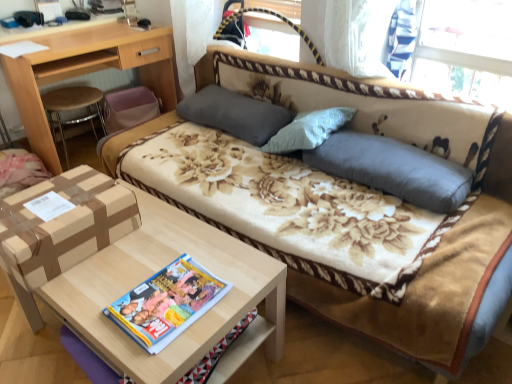
This screenshot has height=384, width=512. What do you see at coordinates (64, 224) in the screenshot? I see `brown cardboard box at lower left` at bounding box center [64, 224].

Locate an element on the screen. gray fabric pillow at center, acting as the 1th pillow starting from the front is located at coordinates (393, 169).

What is the approximate width of light brown wood desk at upper left?

It is 20.64 inches.

Where is `floral fabric studio couch at center`? floral fabric studio couch at center is located at coordinates (428, 280).

The height and width of the screenshot is (384, 512). I want to click on gray fabric pillow at center, which appears as the second pillow when viewed from the front, so coord(234,114).

Would you say gray fabric pillow at center, marked as the first pillow in a right-to-left arrangement, is inside or outside brown cardboard box at lower left?

gray fabric pillow at center, marked as the first pillow in a right-to-left arrangement, is located beyond the bounds of brown cardboard box at lower left.

From a real-world perspective, is gray fabric pillow at center, marked as the first pillow in a right-to-left arrangement, below brown cardboard box at lower left?

Yes, from a real-world perspective, gray fabric pillow at center, marked as the first pillow in a right-to-left arrangement, is below brown cardboard box at lower left.

Is point (435, 181) positioned before point (88, 199)?

That is False.

Locate an element on the screen. cardboard box above the gray fabric pillow at center, the second pillow in the left-to-right sequence (from a real-world perspective) is located at coordinates (64, 224).

Can you confirm if brown cardboard box at lower left is smaller than floral fabric studio couch at center?

Yes.

Is there a large distance between brown cardboard box at lower left and floral fabric studio couch at center?

brown cardboard box at lower left is near floral fabric studio couch at center, not far away.

From a real-world perspective, which is physically below, brown cardboard box at lower left or floral fabric studio couch at center?

From a 3D spatial view, floral fabric studio couch at center is below.

Could you tell me if brown cardboard box at lower left is turned towards floral fabric studio couch at center?

No, brown cardboard box at lower left is not oriented towards floral fabric studio couch at center.

Is light brown wood table at lower left shorter than floral fabric studio couch at center?

Yes.

At what (x,y) coordinates should I click in order to perform the action: click on studio couch in front of the light brown wood table at lower left. Please return your answer as a coordinate pair (x, y). This screenshot has width=512, height=384. Looking at the image, I should click on (428, 280).

Is light brown wood table at lower left to the left or to the right of floral fabric studio couch at center in the image?

light brown wood table at lower left is to the left of floral fabric studio couch at center.

From the image's perspective, who appears lower, light brown wood table at lower left or floral fabric studio couch at center?

light brown wood table at lower left is shown below in the image.

From a real-world perspective, between gray fabric pillow at center, which appears as the first pillow when viewed from the back, and gray fabric pillow at center, marked as the first pillow in a right-to-left arrangement, who is vertically higher?

From a 3D spatial view, gray fabric pillow at center, which appears as the first pillow when viewed from the back, is above.

Is gray fabric pillow at center, the first pillow viewed from the left, positioned before gray fabric pillow at center, the second pillow positioned from the back?

No.

Is gray fabric pillow at center, acting as the 1th pillow starting from the front, surrounded by gray fabric pillow at center, the first pillow viewed from the left?

That's incorrect, gray fabric pillow at center, acting as the 1th pillow starting from the front, is not inside gray fabric pillow at center, the first pillow viewed from the left.

From the image's perspective, is gray fabric pillow at center, marked as the 2th pillow in a right-to-left arrangement, on gray fabric pillow at center, acting as the 1th pillow starting from the front?

Yes, from the image's perspective, gray fabric pillow at center, marked as the 2th pillow in a right-to-left arrangement, is on top of gray fabric pillow at center, acting as the 1th pillow starting from the front.

Can you tell me how much light brown wood table at lower left and multicolored glossy magazine at center differ in facing direction?

There is a 0.209-degree angle between the facing directions of light brown wood table at lower left and multicolored glossy magazine at center.

Is light brown wood table at lower left at the right side of multicolored glossy magazine at center?

No.

Does light brown wood table at lower left have a lesser width compared to multicolored glossy magazine at center?

Incorrect, the width of light brown wood table at lower left is not less than that of multicolored glossy magazine at center.

Identify the location of desk behind the multicolored glossy magazine at center. The image size is (512, 384). (87, 71).

Considering the sizes of objects multicolored glossy magazine at center and light brown wood desk at upper left in the image provided, who is thinner, multicolored glossy magazine at center or light brown wood desk at upper left?

multicolored glossy magazine at center.

Which object is positioned more to the left, multicolored glossy magazine at center or light brown wood desk at upper left?

light brown wood desk at upper left is more to the left.

How different are the orientations of light brown wood desk at upper left and light brown wood table at lower left in degrees?

The angular difference between light brown wood desk at upper left and light brown wood table at lower left is 85.1 degrees.

From a real-world perspective, is light brown wood desk at upper left physically below light brown wood table at lower left?

Incorrect, from a real-world perspective, light brown wood desk at upper left is higher than light brown wood table at lower left.

Where is `table in front of the light brown wood desk at upper left`? table in front of the light brown wood desk at upper left is located at coordinates (155, 272).

Choose the correct answer: Is light brown wood desk at upper left inside light brown wood table at lower left or outside it?

light brown wood desk at upper left lies outside light brown wood table at lower left.

Image resolution: width=512 pixels, height=384 pixels. Find the location of `cardboard box on the left of gray fabric pillow at center, the second pillow in the left-to-right sequence`. cardboard box on the left of gray fabric pillow at center, the second pillow in the left-to-right sequence is located at coordinates (64, 224).

At what (x,y) coordinates should I click in order to perform the action: click on studio couch above the brown cardboard box at lower left (from the image's perspective). Please return your answer as a coordinate pair (x, y). Image resolution: width=512 pixels, height=384 pixels. Looking at the image, I should click on (428, 280).

When comparing their distances from light brown wood table at lower left, does floral fabric studio couch at center or brown cardboard box at lower left seem closer?

Among the two, brown cardboard box at lower left is located nearer to light brown wood table at lower left.

From the image, which object appears to be nearer to gray fabric pillow at center, which appears as the second pillow when viewed from the front, gray fabric pillow at center, marked as the first pillow in a right-to-left arrangement, or multicolored glossy magazine at center?

gray fabric pillow at center, marked as the first pillow in a right-to-left arrangement, is closer to gray fabric pillow at center, which appears as the second pillow when viewed from the front.

Looking at the image, which one is located closer to light brown wood desk at upper left, light brown wood table at lower left or gray fabric pillow at center, marked as the 2th pillow in a right-to-left arrangement?

Based on the image, gray fabric pillow at center, marked as the 2th pillow in a right-to-left arrangement, appears to be nearer to light brown wood desk at upper left.

Based on their spatial positions, is multicolored glossy magazine at center or gray fabric pillow at center, the first pillow viewed from the left, further from gray fabric pillow at center, the second pillow in the left-to-right sequence?

Based on the image, multicolored glossy magazine at center appears to be further to gray fabric pillow at center, the second pillow in the left-to-right sequence.

From the image, which object appears to be farther from floral fabric studio couch at center, light brown wood table at lower left or multicolored glossy magazine at center?

multicolored glossy magazine at center is further to floral fabric studio couch at center.

From the image, which object appears to be farther from floral fabric studio couch at center, gray fabric pillow at center, the first pillow viewed from the left, or multicolored glossy magazine at center?

gray fabric pillow at center, the first pillow viewed from the left, is further to floral fabric studio couch at center.

Looking at the image, which one is located further to multicolored glossy magazine at center, brown cardboard box at lower left or light brown wood desk at upper left?

light brown wood desk at upper left is further to multicolored glossy magazine at center.

When comparing their distances from brown cardboard box at lower left, does light brown wood table at lower left or gray fabric pillow at center, marked as the first pillow in a right-to-left arrangement, seem further?

gray fabric pillow at center, marked as the first pillow in a right-to-left arrangement.

The width and height of the screenshot is (512, 384). What are the coordinates of `table between floral fabric studio couch at center and gray fabric pillow at center, marked as the 2th pillow in a right-to-left arrangement, in the front-back direction` in the screenshot? It's located at (155, 272).

Locate an element on the screen. Image resolution: width=512 pixels, height=384 pixels. pillow between light brown wood desk at upper left and gray fabric pillow at center, the second pillow in the left-to-right sequence, from left to right is located at coordinates (234, 114).

The width and height of the screenshot is (512, 384). In order to click on magazine that lies between floral fabric studio couch at center and light brown wood table at lower left from top to bottom in this screenshot , I will do `click(167, 303)`.

Locate an element on the screen. Image resolution: width=512 pixels, height=384 pixels. table between brown cardboard box at lower left and multicolored glossy magazine at center from left to right is located at coordinates (155, 272).